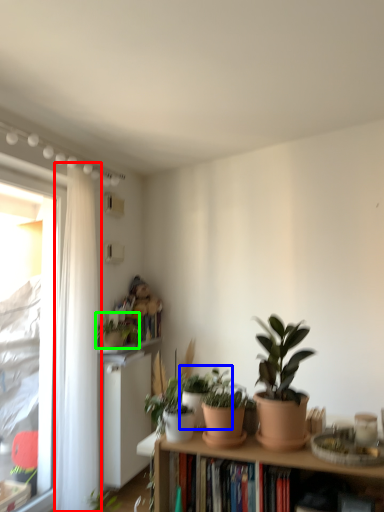
Question: Estimate the real-world distances between objects in this image. Which object is closer to curtain (highlighted by a red box), houseplant (highlighted by a blue box) or houseplant (highlighted by a green box)?

Choices:
 (A) houseplant
 (B) houseplant

Answer: (B)